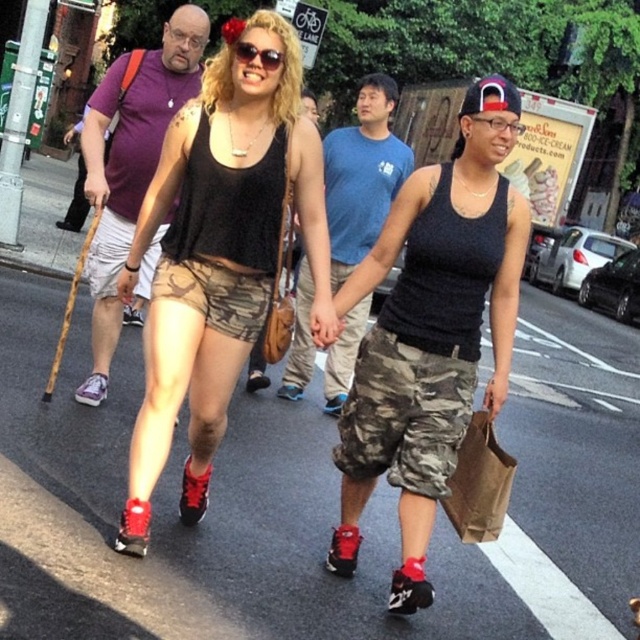
Question: Does purple cotton t-shirt at upper left appear on the left side of blue cotton t-shirt at center?

Choices:
 (A) yes
 (B) no

Answer: (A)

Question: Which point appears closest to the camera in this image?

Choices:
 (A) (340, 184)
 (B) (232, 244)
 (C) (99, 109)

Answer: (B)

Question: Which of the following is the closest to the observer?

Choices:
 (A) purple cotton t-shirt at upper left
 (B) camo shorts at center

Answer: (B)

Question: Which point is closer to the camera taking this photo?

Choices:
 (A) (358, 164)
 (B) (156, 244)
 (C) (394, 573)

Answer: (C)

Question: Does black matte tank top at center appear under purple cotton t-shirt at upper left?

Choices:
 (A) yes
 (B) no

Answer: (A)

Question: Does camo shorts at center come behind purple cotton t-shirt at upper left?

Choices:
 (A) yes
 (B) no

Answer: (B)